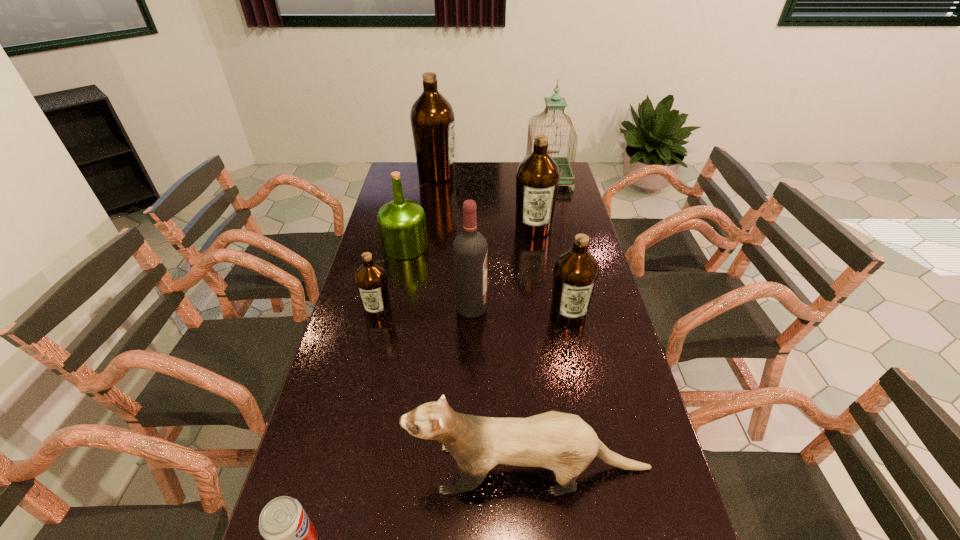
Locate an element on the screen. The height and width of the screenshot is (540, 960). the smallest brown olive oil is located at coordinates (371, 279).

Locate an element on the screen. This screenshot has width=960, height=540. vacant position located 0.210m on the label of the biggest brown olive oil is located at coordinates (502, 174).

Image resolution: width=960 pixels, height=540 pixels. I want to click on free spot located at the door of the birdcage, so click(562, 240).

I want to click on free space located on the label of the wine bottle, so click(x=581, y=307).

This screenshot has width=960, height=540. Find the location of `vacant space situated 0.150m on the label of the third smallest brown olive oil`. vacant space situated 0.150m on the label of the third smallest brown olive oil is located at coordinates (540, 265).

Locate an element on the screen. Image resolution: width=960 pixels, height=540 pixels. free space located 0.050m on the left of the green olive oil is located at coordinates (369, 246).

The width and height of the screenshot is (960, 540). I want to click on blank space located 0.290m on the label of the second smallest brown olive oil, so click(589, 416).

Locate an element on the screen. vacant space located on the face of the gray ferret is located at coordinates (313, 468).

Find the location of a particular element. The height and width of the screenshot is (540, 960). vacant point located on the face of the gray ferret is located at coordinates (309, 468).

Where is `vacant space located 0.190m on the face of the gray ferret`? The image size is (960, 540). vacant space located 0.190m on the face of the gray ferret is located at coordinates pos(326,468).